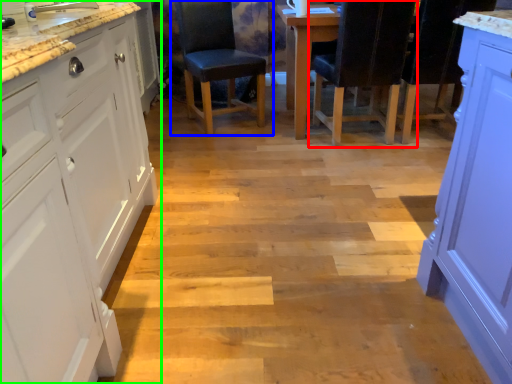
Question: Based on their relative distances, which object is nearer to chair (highlighted by a red box)? Choose from chair (highlighted by a blue box) and cabinetry (highlighted by a green box).

Choices:
 (A) chair
 (B) cabinetry

Answer: (A)